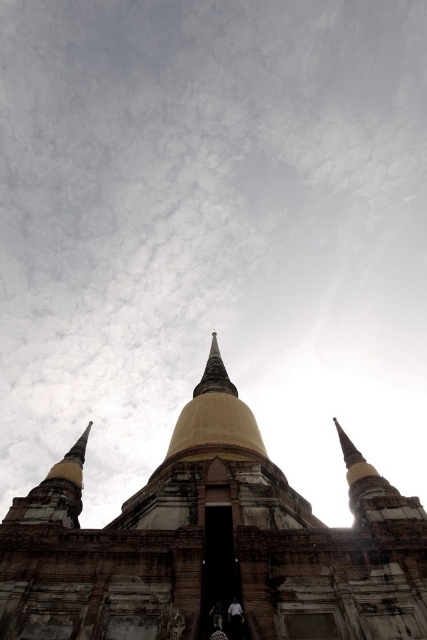
The width and height of the screenshot is (427, 640). What do you see at coordinates (213, 547) in the screenshot?
I see `gold/golden stone temple at center` at bounding box center [213, 547].

Does gold/golden stone temple at center have a lesser width compared to gold/golden stupa at center?

Incorrect, gold/golden stone temple at center's width is not less than gold/golden stupa at center's.

Find the location of `gold/golden stone temple at center`. gold/golden stone temple at center is located at coordinates pyautogui.click(x=213, y=547).

Identify the location of gold/golden stone temple at center. The height and width of the screenshot is (640, 427). [x=213, y=547].